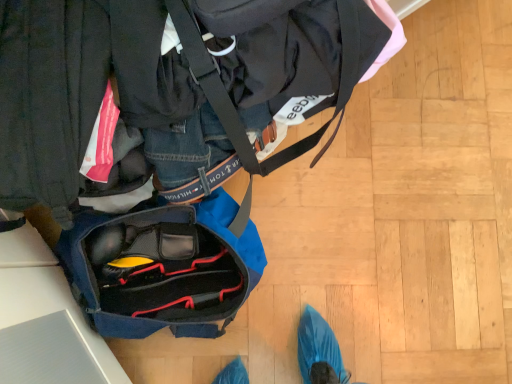
The height and width of the screenshot is (384, 512). Describe the element at coordinates (170, 85) in the screenshot. I see `blue fabric bag at lower left` at that location.

Where is `blue fabric bag at lower left`? This screenshot has height=384, width=512. blue fabric bag at lower left is located at coordinates (170, 85).

Measure the distance between blue fabric bag at lower left and camera.

blue fabric bag at lower left and camera are 21.88 inches apart from each other.

You are a GUI agent. You are given a task and a screenshot of the screen. Output one action in this format:
    pyautogui.click(x=<x>, y=<y>)
    Task: Click on the blue fabric bag at lower left
    
    Given the screenshot: What is the action you would take?
    pyautogui.click(x=170, y=85)